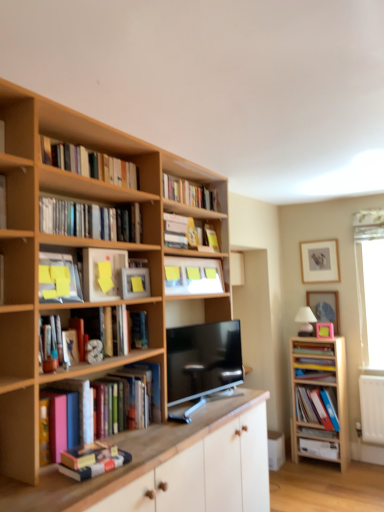
Question: Is wooden cabinet at right, which is counted as the second cabinetry, starting from the front, shorter than black glossy tv at center?

Choices:
 (A) yes
 (B) no

Answer: (B)

Question: Does wooden cabinet at right, which is counted as the second cabinetry, starting from the front, appear on the left side of black glossy tv at center?

Choices:
 (A) no
 (B) yes

Answer: (A)

Question: Does wooden cabinet at right, acting as the 1th cabinetry starting from the right, touch black glossy tv at center?

Choices:
 (A) yes
 (B) no

Answer: (B)

Question: Is wooden cabinet at right, acting as the 1th cabinetry starting from the right, thinner than black glossy tv at center?

Choices:
 (A) no
 (B) yes

Answer: (A)

Question: Is wooden cabinet at right, which is counted as the second cabinetry, starting from the front, to the right of black glossy tv at center from the viewer's perspective?

Choices:
 (A) yes
 (B) no

Answer: (A)

Question: Is point pos(168,183) positioned closer to the camera than point pos(125,442)?

Choices:
 (A) closer
 (B) farther

Answer: (B)

Question: Based on their sizes in the image, would you say hardcover book at upper center, marked as the 10th book in a bottom-to-top arrangement, is bigger or smaller than wooden cabinet at center, the 1th cabinetry from the left?

Choices:
 (A) small
 (B) big

Answer: (A)

Question: Is hardcover book at upper center, marked as the 10th book in a bottom-to-top arrangement, wider or thinner than wooden cabinet at center, the 2th cabinetry in the right-to-left sequence?

Choices:
 (A) wide
 (B) thin

Answer: (B)

Question: Considering the relative positions of hardcover book at upper center, marked as the 10th book in a bottom-to-top arrangement, and wooden cabinet at center, the first cabinetry in the front-to-back sequence, in the image provided, is hardcover book at upper center, marked as the 10th book in a bottom-to-top arrangement, to the left or to the right of wooden cabinet at center, the first cabinetry in the front-to-back sequence,?

Choices:
 (A) right
 (B) left

Answer: (A)

Question: Does point (213, 233) appear closer or farther from the camera than point (327, 307)?

Choices:
 (A) closer
 (B) farther

Answer: (A)

Question: Considering the positions of hardcover book at upper center, the fifth book viewed from the top, and matte pink picture frame at upper right, which is the 2th picture frame from top to bottom, in the image, is hardcover book at upper center, the fifth book viewed from the top, wider or thinner than matte pink picture frame at upper right, which is the 2th picture frame from top to bottom,?

Choices:
 (A) wide
 (B) thin

Answer: (A)

Question: From a real-world perspective, is hardcover book at upper center, the fifth book viewed from the top, positioned above or below matte pink picture frame at upper right, which is the 2th picture frame in bottom-to-top order?

Choices:
 (A) above
 (B) below

Answer: (A)

Question: Is hardcover book at upper center, placed as the 7th book when sorted from bottom to top, taller or shorter than matte pink picture frame at upper right, which is the 2th picture frame from top to bottom?

Choices:
 (A) tall
 (B) short

Answer: (B)

Question: From a real-world perspective, is black glossy tv at center positioned above or below matte plastic book at left, the 6th book in the top-to-bottom sequence?

Choices:
 (A) below
 (B) above

Answer: (A)

Question: Based on their sizes in the image, would you say black glossy tv at center is bigger or smaller than matte plastic book at left, which ranks as the sixth book in bottom-to-top order?

Choices:
 (A) big
 (B) small

Answer: (A)